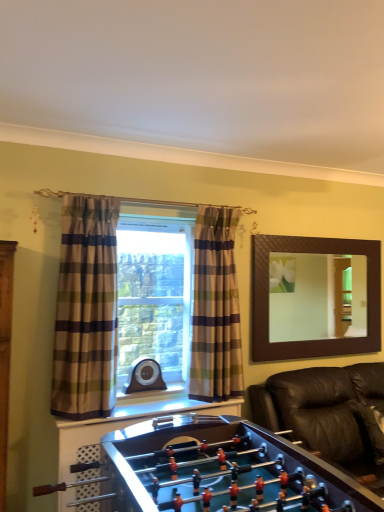
Question: From the image's perspective, relative to plaid fabric curtain at center, the first curtain from the right, is brown textured mirror at upper right above or below?

Choices:
 (A) above
 (B) below

Answer: (B)

Question: Is brown textured mirror at upper right bigger or smaller than plaid fabric curtain at center, which ranks as the 2th curtain in left-to-right order?

Choices:
 (A) big
 (B) small

Answer: (B)

Question: Which of these objects is positioned closest to the brown textured mirror at upper right?

Choices:
 (A) black leather couch at lower right
 (B) plaid fabric curtain at left, the 1th curtain viewed from the left
 (C) plaid fabric curtain at center, the 1th curtain viewed from the back
 (D) shiny brown foosball table at lower center

Answer: (A)

Question: Estimate the real-world distances between objects in this image. Which object is farther from the plaid fabric curtain at left, placed as the 1th curtain when sorted from front to back?

Choices:
 (A) shiny brown foosball table at lower center
 (B) brown textured mirror at upper right
 (C) plaid fabric curtain at center, the first curtain from the right
 (D) black leather couch at lower right

Answer: (B)